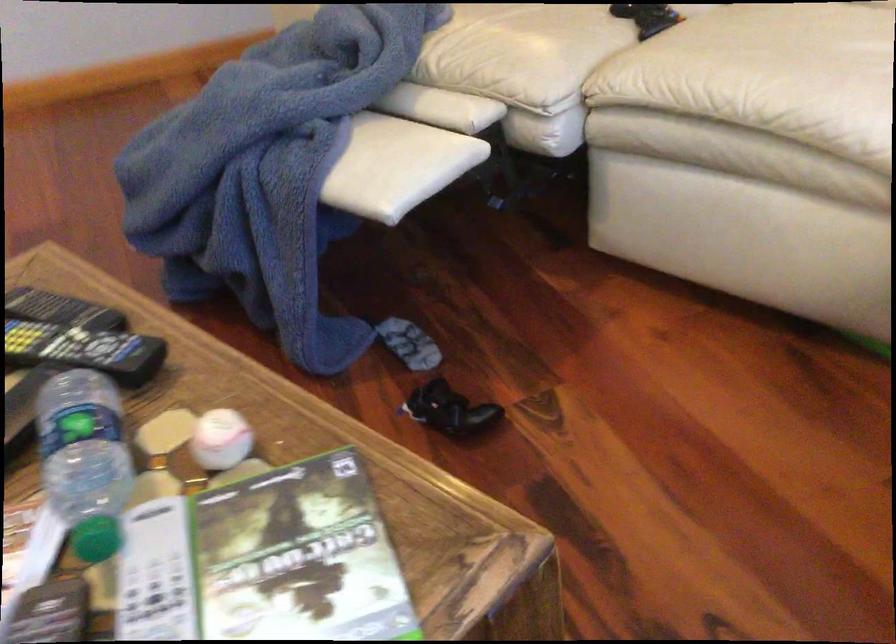
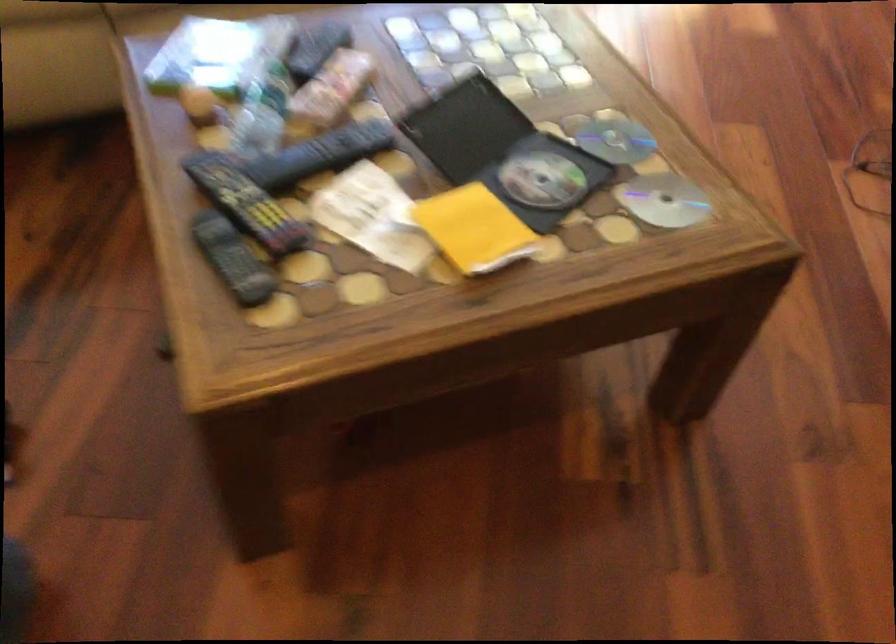
Locate, in the second image, the point that corresponds to [71,290] in the first image.

(233, 259)